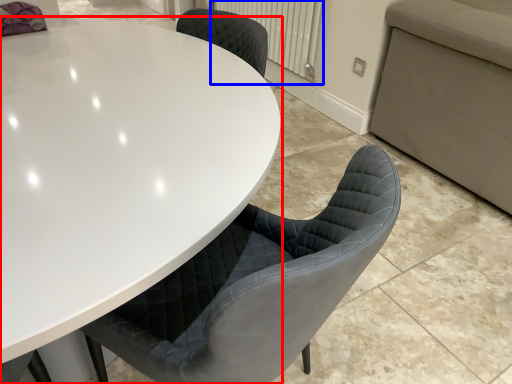
Question: Which point is further to the camera, table (highlighted by a red box) or radiator (highlighted by a blue box)?

Choices:
 (A) table
 (B) radiator

Answer: (B)